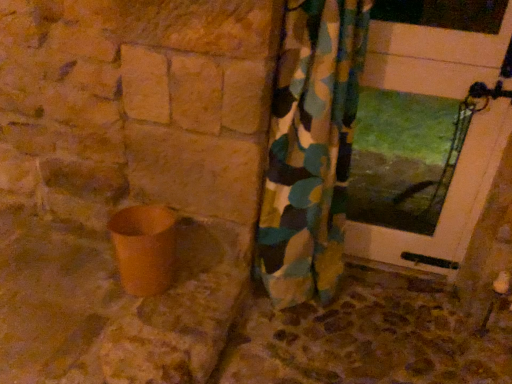
Question: Is camouflage fabric curtain at center not near white glossy door at upper right?

Choices:
 (A) no
 (B) yes

Answer: (A)

Question: Is camouflage fabric curtain at center touching white glossy door at upper right?

Choices:
 (A) no
 (B) yes

Answer: (A)

Question: From a real-world perspective, is camouflage fabric curtain at center positioned over white glossy door at upper right based on gravity?

Choices:
 (A) no
 (B) yes

Answer: (A)

Question: From a real-world perspective, is camouflage fabric curtain at center below white glossy door at upper right?

Choices:
 (A) no
 (B) yes

Answer: (B)

Question: Can you confirm if camouflage fabric curtain at center is smaller than white glossy door at upper right?

Choices:
 (A) no
 (B) yes

Answer: (A)

Question: From a real-world perspective, is brown stone concrete at lower center above or below camouflage fabric curtain at center?

Choices:
 (A) below
 (B) above

Answer: (A)

Question: Considering the positions of brown stone concrete at lower center and camouflage fabric curtain at center in the image, is brown stone concrete at lower center wider or thinner than camouflage fabric curtain at center?

Choices:
 (A) thin
 (B) wide

Answer: (B)

Question: Is brown stone concrete at lower center spatially inside camouflage fabric curtain at center, or outside of it?

Choices:
 (A) outside
 (B) inside

Answer: (A)

Question: In terms of size, does brown stone concrete at lower center appear bigger or smaller than camouflage fabric curtain at center?

Choices:
 (A) small
 (B) big

Answer: (A)

Question: Is point (473, 129) closer or farther from the camera than point (347, 61)?

Choices:
 (A) farther
 (B) closer

Answer: (A)

Question: Looking at the image, does white glossy door at upper right seem bigger or smaller compared to camouflage fabric curtain at center?

Choices:
 (A) big
 (B) small

Answer: (B)

Question: Visually, is white glossy door at upper right positioned to the left or to the right of camouflage fabric curtain at center?

Choices:
 (A) right
 (B) left

Answer: (A)

Question: Is white glossy door at upper right inside the boundaries of camouflage fabric curtain at center, or outside?

Choices:
 (A) inside
 (B) outside

Answer: (B)

Question: Considering the positions of camouflage fabric curtain at center and matte brown pot at lower left in the image, is camouflage fabric curtain at center wider or thinner than matte brown pot at lower left?

Choices:
 (A) wide
 (B) thin

Answer: (A)

Question: Does point (334, 220) appear closer or farther from the camera than point (153, 215)?

Choices:
 (A) closer
 (B) farther

Answer: (B)